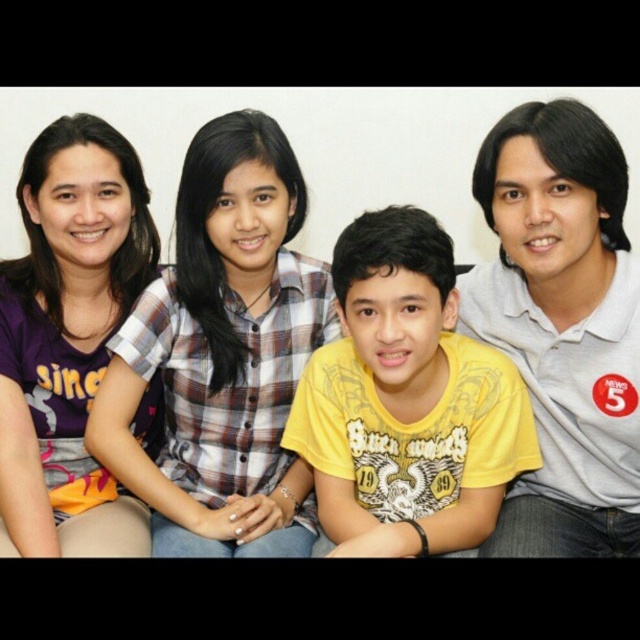
Question: Which object is farther from the camera taking this photo?

Choices:
 (A) purple matte shirt at upper left
 (B) yellow matte shirt at center
 (C) matte yellow t-shirt at center

Answer: (C)

Question: Which point is farther to the camera?

Choices:
 (A) (58, 147)
 (B) (429, 321)
 (C) (188, 97)

Answer: (C)

Question: Is yellow matte shirt at center closer to the viewer compared to purple matte shirt at upper left?

Choices:
 (A) yes
 (B) no

Answer: (A)

Question: Can you confirm if yellow matte shirt at center is positioned below matte yellow t-shirt at center?

Choices:
 (A) yes
 (B) no

Answer: (A)

Question: Which of the following is the closest to the observer?

Choices:
 (A) purple matte shirt at upper left
 (B) plaid fabric shirt at center
 (C) matte yellow t-shirt at center

Answer: (B)

Question: Is plaid fabric shirt at center to the left of gray matte polo shirt at right from the viewer's perspective?

Choices:
 (A) yes
 (B) no

Answer: (A)